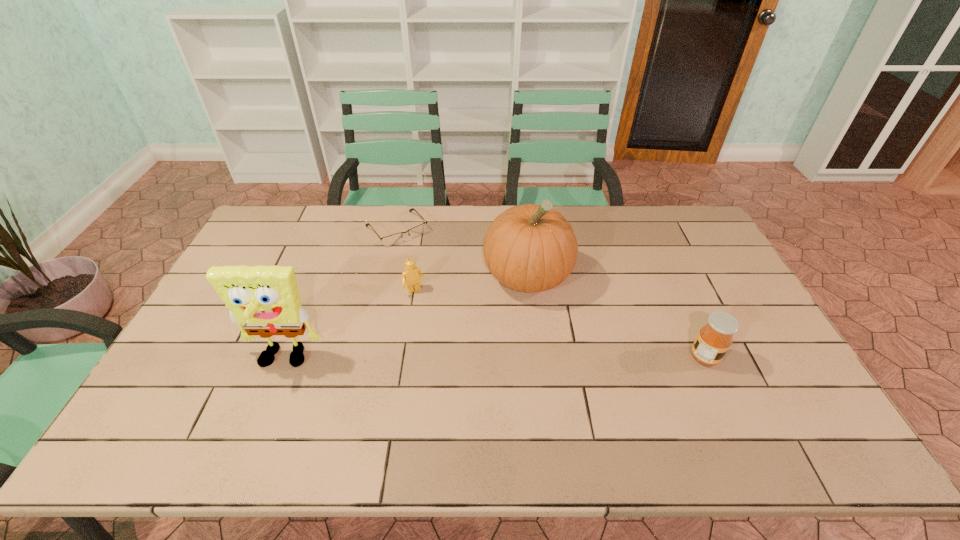
Locate an element on the screen. This screenshot has height=540, width=960. free spot located 0.240m on the stem of the pumpkin is located at coordinates (543, 377).

This screenshot has height=540, width=960. I want to click on vacant space located 0.170m on the front-facing side of the shortest object, so click(435, 273).

Identify the location of free space located on the front-facing side of the shortest object. This screenshot has height=540, width=960. (462, 305).

You are a GUI agent. You are given a task and a screenshot of the screen. Output one action in this format:
    pyautogui.click(x=<x>, y=<y>)
    Task: Click on the free region located 0.090m on the front-facing side of the shortest object
    The width and height of the screenshot is (960, 540).
    Given the screenshot: What is the action you would take?
    pyautogui.click(x=423, y=259)

This screenshot has height=540, width=960. Find the location of `vacant space located 0.180m on the face of the second shortest object`. vacant space located 0.180m on the face of the second shortest object is located at coordinates (444, 338).

This screenshot has height=540, width=960. Find the location of `vacant area situated 0.290m on the face of the second shortest object`. vacant area situated 0.290m on the face of the second shortest object is located at coordinates (460, 367).

Identify the location of vacant point located 0.380m on the face of the second shortest object. The width and height of the screenshot is (960, 540). (476, 393).

In order to click on object located at the far edge in this screenshot , I will do `click(393, 239)`.

In the image, there is a desktop. What are the coordinates of `free space at the far edge` in the screenshot? It's located at (374, 233).

Identify the location of free space at the left edge of the desktop. This screenshot has height=540, width=960. (191, 333).